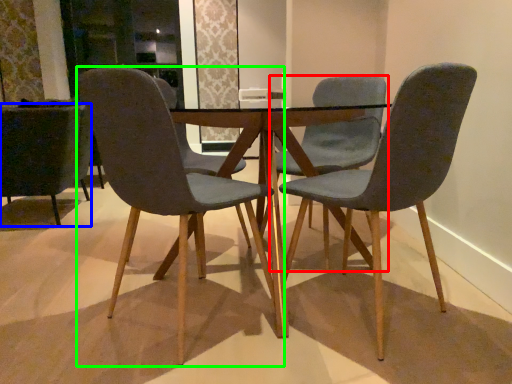
Question: Estimate the real-world distances between objects in this image. Which object is closer to chair (highlighted by a red box), chair (highlighted by a blue box) or chair (highlighted by a green box)?

Choices:
 (A) chair
 (B) chair

Answer: (B)